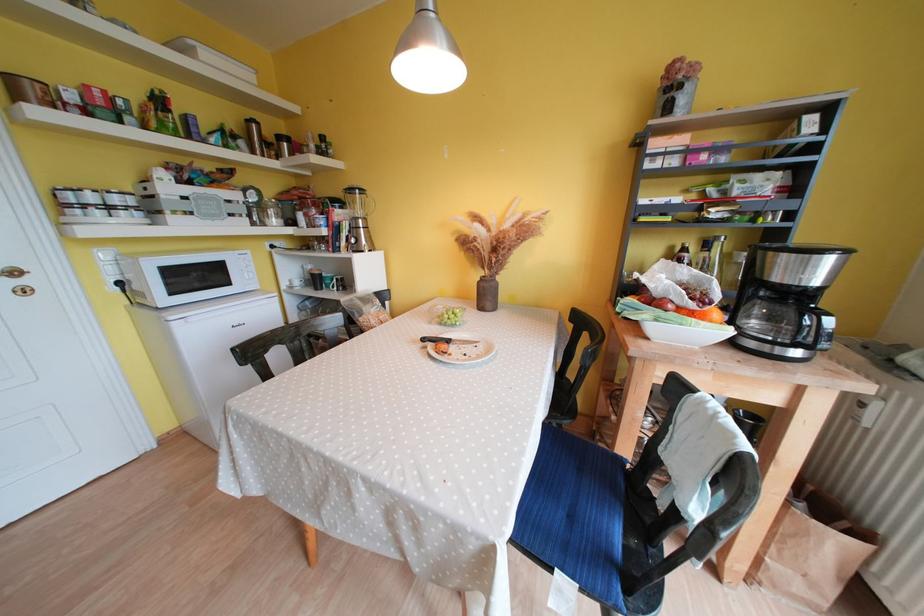
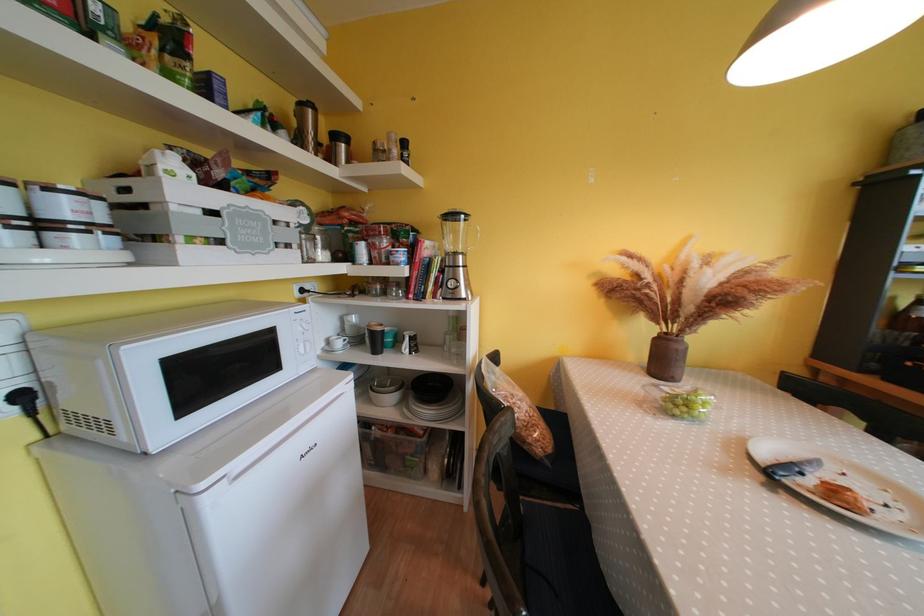
Find the pixel in the second image that matches (x=253, y=124) in the first image.

(308, 108)